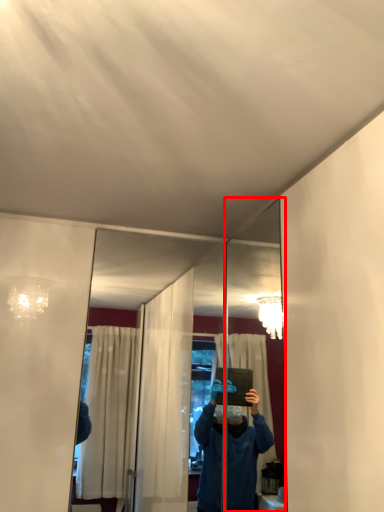
Question: In this image, where is mirror (annotated by the red box) located relative to mirror?

Choices:
 (A) left
 (B) right

Answer: (B)